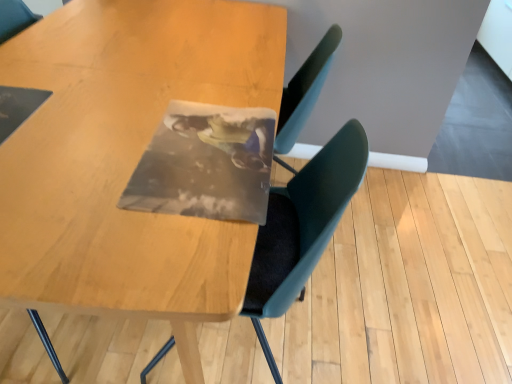
Measure the distance between matte plastic photo frame at center and camera.

matte plastic photo frame at center is 34.92 inches away from camera.

Image resolution: width=512 pixels, height=384 pixels. I want to click on matte plastic photo frame at center, so click(x=302, y=228).

This screenshot has width=512, height=384. What do you see at coordinates (302, 228) in the screenshot?
I see `matte plastic photo frame at center` at bounding box center [302, 228].

You are a GUI agent. You are given a task and a screenshot of the screen. Output one action in this format:
    pyautogui.click(x=<x>, y=<y>)
    Task: Click on the wooden table at center
    The width and height of the screenshot is (512, 384).
    Given the screenshot: What is the action you would take?
    pyautogui.click(x=126, y=159)

The height and width of the screenshot is (384, 512). Describe the element at coordinates (126, 159) in the screenshot. I see `wooden table at center` at that location.

In order to face wooden table at center, should I rotate leftwards or rightwards?

Rotate your view left by about 14.686°.

Locate an element on the screen. The image size is (512, 384). matte plastic photo frame at center is located at coordinates (302, 228).

Which object is positioned more to the right, matte plastic photo frame at center or wooden table at center?

matte plastic photo frame at center.

Considering the relative positions of matte plastic photo frame at center and wooden table at center in the image provided, is matte plastic photo frame at center behind wooden table at center?

Yes, matte plastic photo frame at center is further from the camera.

Is point (275, 201) behind point (25, 273)?

That is True.

From the image's perspective, is matte plastic photo frame at center under wooden table at center?

Correct, matte plastic photo frame at center appears lower than wooden table at center in the image.

From a real-world perspective, between matte plastic photo frame at center and wooden table at center, who is vertically higher?

matte plastic photo frame at center.

Considering the relative sizes of matte plastic photo frame at center and wooden table at center in the image provided, is matte plastic photo frame at center thinner than wooden table at center?

Yes, matte plastic photo frame at center is thinner than wooden table at center.

Between matte plastic photo frame at center and wooden table at center, which one has more height?

matte plastic photo frame at center is taller.

Considering the sizes of matte plastic photo frame at center and wooden table at center in the image, is matte plastic photo frame at center bigger or smaller than wooden table at center?

Clearly, matte plastic photo frame at center is smaller in size than wooden table at center.

Is matte plastic photo frame at center inside the boundaries of wooden table at center, or outside?

matte plastic photo frame at center is enclosed within wooden table at center.

Is matte plastic photo frame at center touching wooden table at center?

No, matte plastic photo frame at center is not in contact with wooden table at center.

Is matte plastic photo frame at center oriented towards wooden table at center?

Yes, matte plastic photo frame at center is facing wooden table at center.

The image size is (512, 384). Find the location of `table in front of the matte plastic photo frame at center`. table in front of the matte plastic photo frame at center is located at coordinates (126, 159).

Is wooden table at center at the left side of matte plastic photo frame at center?

Correct, you'll find wooden table at center to the left of matte plastic photo frame at center.

Is wooden table at center in front of or behind matte plastic photo frame at center in the image?

Visually, wooden table at center is located in front of matte plastic photo frame at center.

Which is closer, (x=120, y=253) or (x=245, y=314)?

Point (x=120, y=253) is positioned closer to the camera compared to point (x=245, y=314).

From the image's perspective, which object appears higher, wooden table at center or matte plastic photo frame at center?

wooden table at center, from the image's perspective.

From a real-world perspective, who is located lower, wooden table at center or matte plastic photo frame at center?

wooden table at center is physically lower.

Considering the relative sizes of wooden table at center and matte plastic photo frame at center in the image provided, is wooden table at center wider than matte plastic photo frame at center?

Yes, wooden table at center is wider than matte plastic photo frame at center.

From their relative heights in the image, would you say wooden table at center is taller or shorter than matte plastic photo frame at center?

In the image, wooden table at center appears to be shorter than matte plastic photo frame at center.

Between wooden table at center and matte plastic photo frame at center, which one has smaller size?

With smaller size is matte plastic photo frame at center.

Is matte plastic photo frame at center inside wooden table at center?

Yes, wooden table at center contains matte plastic photo frame at center.

Is wooden table at center with matte plastic photo frame at center?

wooden table at center and matte plastic photo frame at center are not in contact.

Is wooden table at center looking in the opposite direction of matte plastic photo frame at center?

Absolutely, wooden table at center is directed away from matte plastic photo frame at center.

Measure the distance between wooden table at center and matte plastic photo frame at center.

wooden table at center and matte plastic photo frame at center are 18.27 inches apart.

The width and height of the screenshot is (512, 384). Identify the location of table on the left of the matte plastic photo frame at center. (126, 159).

Locate an element on the screen. This screenshot has height=384, width=512. chair above the wooden table at center (from a real-world perspective) is located at coordinates (302, 228).

Locate an element on the screen. The image size is (512, 384). table to the left of matte plastic photo frame at center is located at coordinates (126, 159).